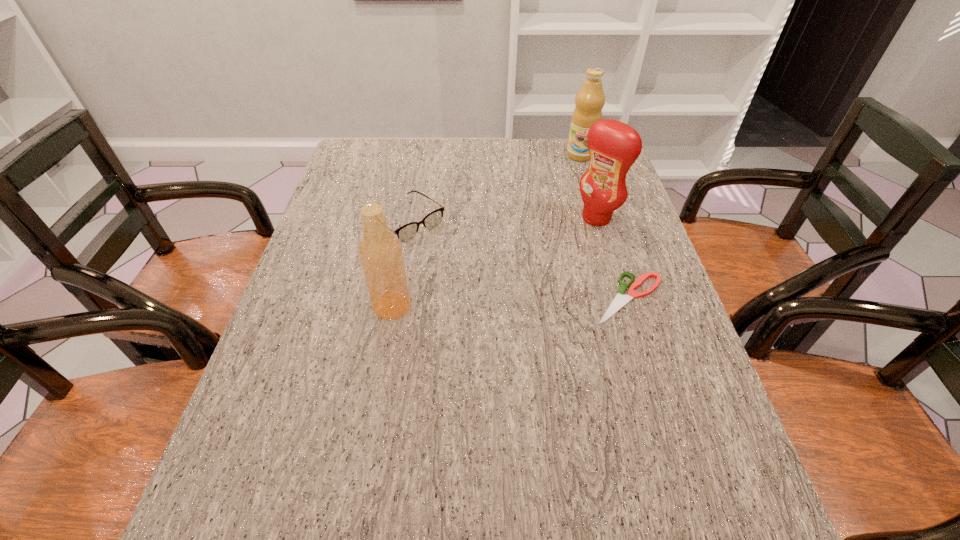
The image size is (960, 540). What are the coordinates of `blank space located 0.160m on the label side of the condiment` in the screenshot? It's located at (547, 255).

The height and width of the screenshot is (540, 960). I want to click on free space located 0.260m on the label side of the condiment, so click(521, 274).

You are a GUI agent. You are given a task and a screenshot of the screen. Output one action in this format:
    pyautogui.click(x=<x>, y=<y>)
    Task: Click on the free space located on the label side of the condiment
    The height and width of the screenshot is (540, 960).
    Given the screenshot: What is the action you would take?
    pyautogui.click(x=555, y=249)

This screenshot has width=960, height=540. Find the location of `vacant region located 0.190m on the label of the farthest object`. vacant region located 0.190m on the label of the farthest object is located at coordinates (569, 195).

Locate an element on the screen. The image size is (960, 540). vacant region located 0.370m on the label of the farthest object is located at coordinates (559, 232).

Find the location of `free space located on the label of the farthest object`. free space located on the label of the farthest object is located at coordinates (564, 217).

Where is `object that is positioned at the far edge`? This screenshot has height=540, width=960. object that is positioned at the far edge is located at coordinates [590, 99].

Find the location of a particular element. This screenshot has width=960, height=540. object positioned at the left edge is located at coordinates (407, 232).

Where is `scissors that is at the right edge`? This screenshot has width=960, height=540. scissors that is at the right edge is located at coordinates (620, 300).

Locate an element on the screen. This screenshot has width=960, height=540. condiment at the right edge is located at coordinates (614, 146).